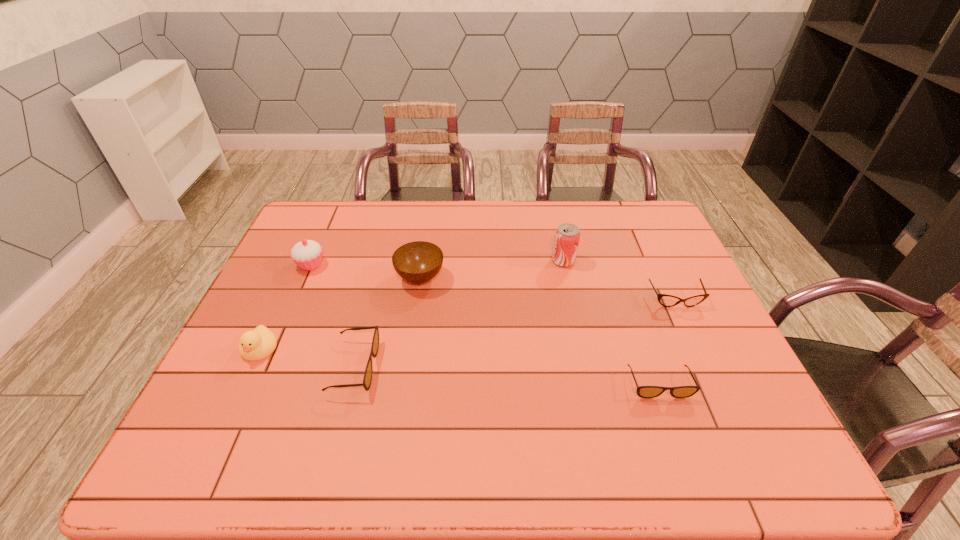
At what (x,y) coordinates should I click in order to perform the action: click on free spot between the spectacles and the bowl. Please return your answer as a coordinate pair (x, y). This screenshot has height=540, width=960. Looking at the image, I should click on (547, 289).

Identify the location of vacant space that's between the duckling and the spectacles. This screenshot has width=960, height=540. [468, 324].

At what (x,y) coordinates should I click in order to perform the action: click on vacant space that is in between the taller sunglasses and the cupcake. Please return your answer as a coordinate pair (x, y). This screenshot has height=540, width=960. Looking at the image, I should click on (332, 316).

I want to click on free space between the duckling and the taller sunglasses, so click(307, 357).

Locate an element on the screen. blank region between the fourth object from right to left and the third object from right to left is located at coordinates (492, 269).

Select which object appears as the fourth closest to the cupcake. Please provide its 2D coordinates. Your answer should be formatted as a tuple, i.e. [(x, y)], where the tuple contains the x and y coordinates of a point satisfying the conditions above.

[(566, 240)]

Where is `the second closest object to the soda can`? The height and width of the screenshot is (540, 960). the second closest object to the soda can is located at coordinates (418, 262).

At what (x,y) coordinates should I click in order to perform the action: click on free space that satisfies the following two spatial constraints: 1. on the back side of the cupcake; 2. on the left side of the soda can. Please return your answer as a coordinate pair (x, y). The image size is (960, 540). Looking at the image, I should click on (312, 261).